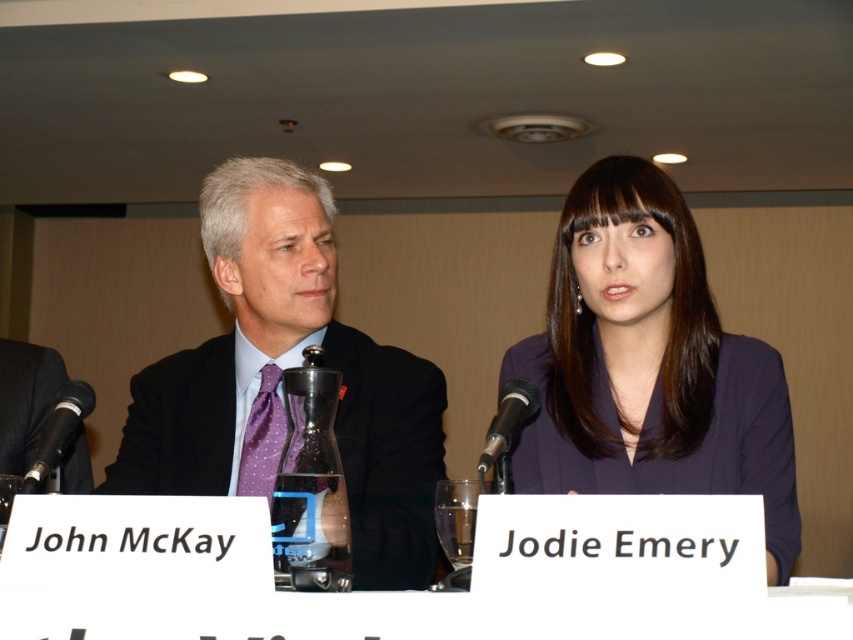
Question: Which point is farther from the camera taking this photo?

Choices:
 (A) (392, 410)
 (B) (503, 490)
 (C) (61, 410)

Answer: (A)

Question: Is black matte microphone at left positioned in front of black metallic microphone at center?

Choices:
 (A) yes
 (B) no

Answer: (B)

Question: Is the position of black matte microphone at left less distant than that of black metallic microphone at center?

Choices:
 (A) yes
 (B) no

Answer: (B)

Question: Which point is closer to the camera taking this photo?

Choices:
 (A) (287, 225)
 (B) (503, 458)
 (C) (782, 532)

Answer: (B)

Question: Can you confirm if black matte microphone at left is positioned to the left of black metallic microphone at center?

Choices:
 (A) yes
 (B) no

Answer: (A)

Question: Which point is closer to the camera?

Choices:
 (A) (65, 390)
 (B) (140, 394)
 (C) (548, 307)

Answer: (A)